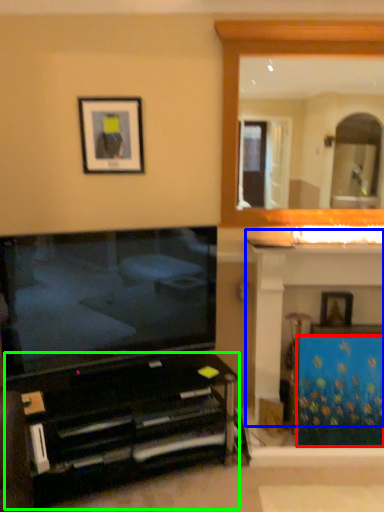
Question: Which object is positioned closest to curtain (highlighted by a red box)? Select from dresser (highlighted by a blue box) and furniture (highlighted by a green box).

Choices:
 (A) dresser
 (B) furniture

Answer: (A)